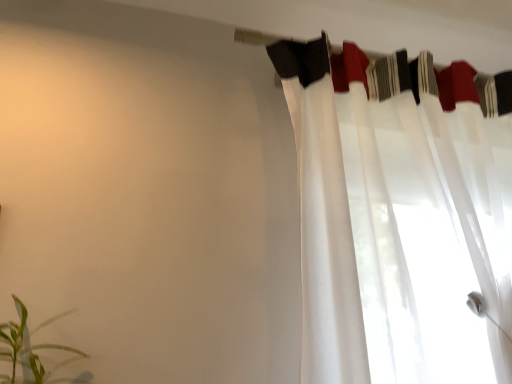
Question: Is green leafy plant at lower left next to white sheer fabric at upper center?

Choices:
 (A) no
 (B) yes

Answer: (A)

Question: Would you say green leafy plant at lower left contains white sheer fabric at upper center?

Choices:
 (A) no
 (B) yes

Answer: (A)

Question: From a real-world perspective, is green leafy plant at lower left located beneath white sheer fabric at upper center?

Choices:
 (A) no
 (B) yes

Answer: (B)

Question: Is green leafy plant at lower left not close to white sheer fabric at upper center?

Choices:
 (A) yes
 (B) no

Answer: (B)

Question: Can you confirm if green leafy plant at lower left is positioned to the right of white sheer fabric at upper center?

Choices:
 (A) yes
 (B) no

Answer: (B)

Question: Does green leafy plant at lower left have a smaller size compared to white sheer fabric at upper center?

Choices:
 (A) no
 (B) yes

Answer: (A)

Question: Considering the relative positions of green leafy plant at lower left and white sheer curtain at upper right in the image provided, is green leafy plant at lower left in front of white sheer curtain at upper right?

Choices:
 (A) no
 (B) yes

Answer: (B)

Question: Is green leafy plant at lower left in contact with white sheer curtain at upper right?

Choices:
 (A) yes
 (B) no

Answer: (B)

Question: Can you confirm if green leafy plant at lower left is thinner than white sheer curtain at upper right?

Choices:
 (A) yes
 (B) no

Answer: (A)

Question: From a real-world perspective, is green leafy plant at lower left under white sheer curtain at upper right?

Choices:
 (A) no
 (B) yes

Answer: (B)

Question: Considering the relative sizes of green leafy plant at lower left and white sheer curtain at upper right in the image provided, is green leafy plant at lower left smaller than white sheer curtain at upper right?

Choices:
 (A) no
 (B) yes

Answer: (B)

Question: Can you confirm if green leafy plant at lower left is taller than white sheer curtain at upper right?

Choices:
 (A) yes
 (B) no

Answer: (B)

Question: Is white sheer curtain at upper right positioned in front of green leafy plant at lower left?

Choices:
 (A) yes
 (B) no

Answer: (B)